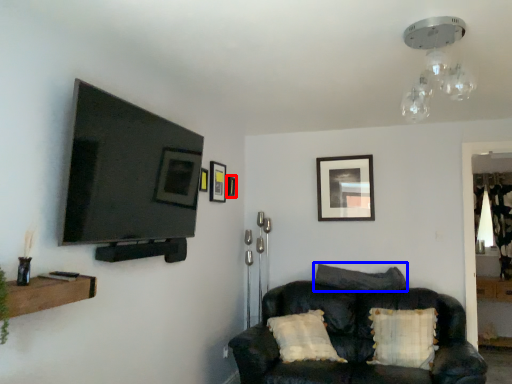
Question: Which object appears closest to the camera in this image, picture frame (highlighted by a red box) or pillow (highlighted by a blue box)?

Choices:
 (A) picture frame
 (B) pillow

Answer: (B)